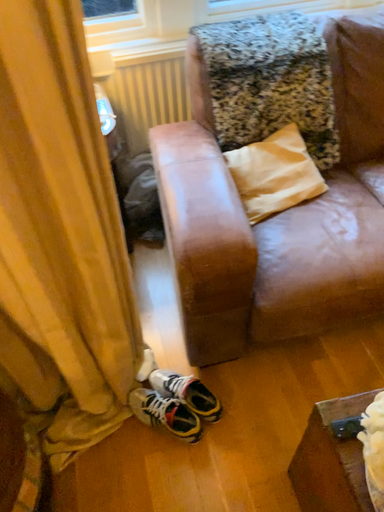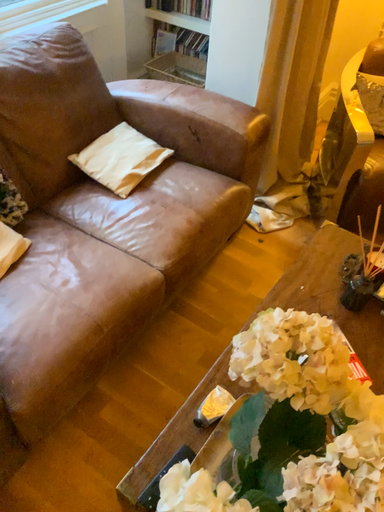
Question: How did the camera likely rotate when shooting the video?

Choices:
 (A) rotated right
 (B) rotated left

Answer: (A)